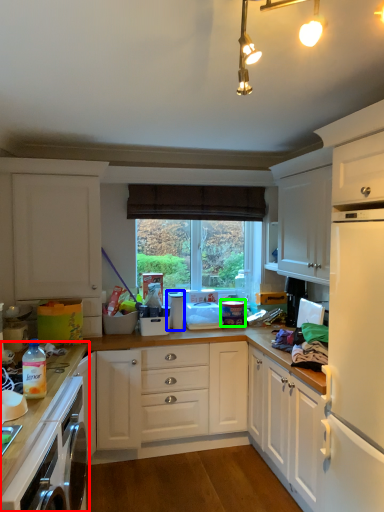
Question: Based on their relative distances, which object is nearer to countertop (highlighted by a red box)? Choose from appliance (highlighted by a blue box) and appliance (highlighted by a green box).

Choices:
 (A) appliance
 (B) appliance

Answer: (A)